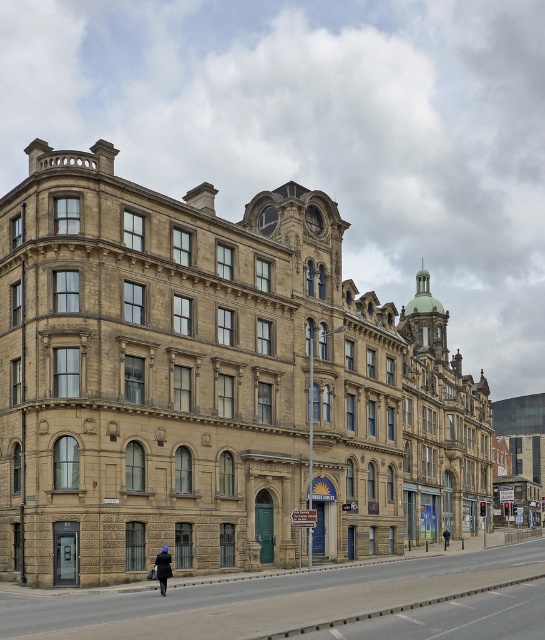
Question: Which point is farther to the camera?

Choices:
 (A) black fabric jacket at center
 (B) dark blue fabric coat at lower center

Answer: (A)

Question: Considering the relative positions of dark blue fabric coat at lower center and black fabric jacket at center in the image provided, where is dark blue fabric coat at lower center located with respect to black fabric jacket at center?

Choices:
 (A) right
 (B) left

Answer: (B)

Question: Is dark blue fabric coat at lower center below black fabric jacket at center?

Choices:
 (A) yes
 (B) no

Answer: (B)

Question: Does dark blue fabric coat at lower center have a lesser width compared to black fabric jacket at center?

Choices:
 (A) no
 (B) yes

Answer: (B)

Question: Which point appears closest to the camera in this image?

Choices:
 (A) (161, 561)
 (B) (446, 536)

Answer: (A)